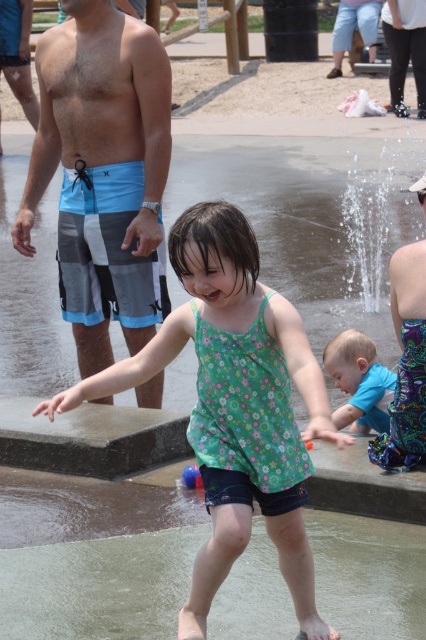
Question: Which of the following is the farthest from the observer?

Choices:
 (A) (423, 202)
 (B) (129, 211)
 (C) (374, 346)

Answer: (B)

Question: Which point is farther from the camera taking this photo?

Choices:
 (A) tap(351, 426)
 (B) tap(284, 371)
 (C) tap(420, 452)
 (D) tap(97, 333)

Answer: (D)

Question: Is green floral dress at center wider than blue striped board shorts at left?

Choices:
 (A) no
 (B) yes

Answer: (B)

Question: Can you confirm if blue striped board shorts at left is positioned above blue cotton shirt at lower center?

Choices:
 (A) yes
 (B) no

Answer: (A)

Question: Can you confirm if blue and gray board shorts at left is positioned to the right of blue striped board shorts at left?

Choices:
 (A) no
 (B) yes

Answer: (A)

Question: Based on their relative distances, which object is nearer to the blue and gray board shorts at left?

Choices:
 (A) blue striped board shorts at left
 (B) green floral dress at center
 (C) blue cotton shirt at lower center

Answer: (C)